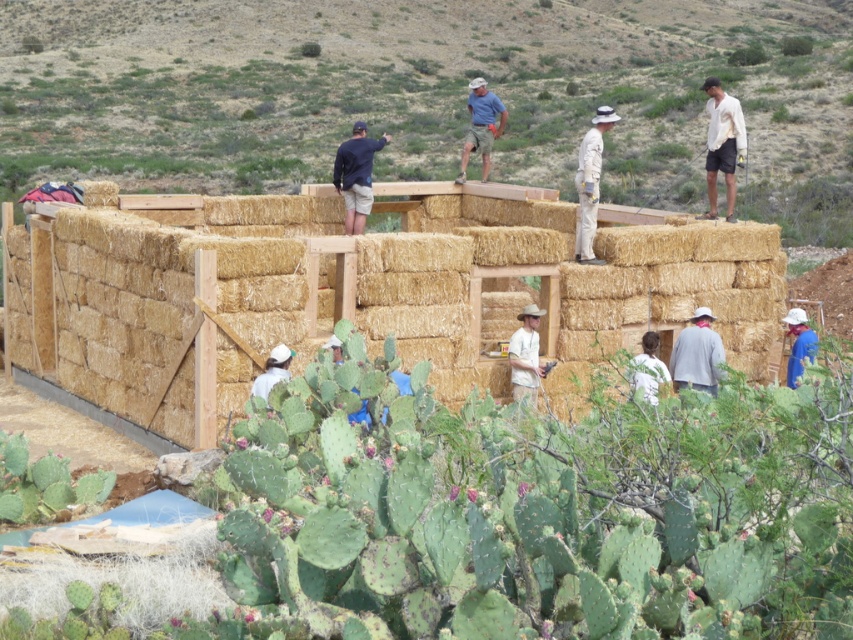
You are a contractor working on a sustainable building project. You have two materials available to use for the next phase of construction. You need to choose between the straw bales at upper center and the natural straw wall at center. Which material should you select if you require a larger size for the next wall section?

The straw bales at upper center is bigger than the natural straw wall at center, so you should select the straw bales at upper center for the next wall section requiring a larger size.

You are a construction worker standing at the point with coordinates (428, 93). Looking around, you see the straw bales at upper center. Where are you relative to the straw bales?

The point (428, 93) corresponds to the straw bales at upper center, so you are standing directly on the straw bales at upper center.

You are an architect designing a sustainable building and you have to choose between using the straw bales at upper center or the blue fabric at lower right for a wall. Considering their widths, which material would you select if you need a wider material for structural support?

The straw bales at upper center are wider than the blue fabric at lower right, so you should choose the straw bales at upper center for better structural support due to their greater width.